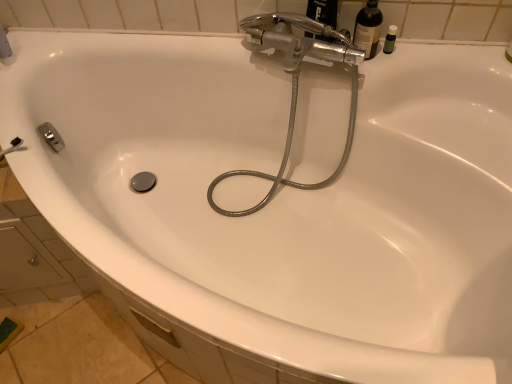
Question: Is the position of green plastic bottle at upper right less distant than that of metallic hose at center?

Choices:
 (A) yes
 (B) no

Answer: (B)

Question: Does green plastic bottle at upper right have a greater width compared to metallic hose at center?

Choices:
 (A) yes
 (B) no

Answer: (B)

Question: Is green plastic bottle at upper right at the right side of metallic hose at center?

Choices:
 (A) no
 (B) yes

Answer: (B)

Question: Is green plastic bottle at upper right positioned behind metallic hose at center?

Choices:
 (A) no
 (B) yes

Answer: (B)

Question: Can you confirm if green plastic bottle at upper right is taller than metallic hose at center?

Choices:
 (A) no
 (B) yes

Answer: (A)

Question: Based on their sizes in the image, would you say green plastic bottle at upper right is bigger or smaller than metallic hose at center?

Choices:
 (A) big
 (B) small

Answer: (B)

Question: From a real-world perspective, relative to metallic hose at center, is green plastic bottle at upper right vertically above or below?

Choices:
 (A) below
 (B) above

Answer: (B)

Question: From their relative heights in the image, would you say green plastic bottle at upper right is taller or shorter than metallic hose at center?

Choices:
 (A) short
 (B) tall

Answer: (A)

Question: Is green plastic bottle at upper right inside or outside of metallic hose at center?

Choices:
 (A) inside
 (B) outside

Answer: (B)

Question: Choose the correct answer: Is metallic hose at center inside green plastic bottle at upper right or outside it?

Choices:
 (A) outside
 (B) inside

Answer: (A)

Question: Does point (352, 77) appear closer or farther from the camera than point (394, 36)?

Choices:
 (A) farther
 (B) closer

Answer: (B)

Question: From their relative heights in the image, would you say metallic hose at center is taller or shorter than green plastic bottle at upper right?

Choices:
 (A) tall
 (B) short

Answer: (A)

Question: Considering their positions, is metallic hose at center located in front of or behind green plastic bottle at upper right?

Choices:
 (A) behind
 (B) front

Answer: (B)

Question: Looking at the image, does metallic hose at center seem bigger or smaller compared to translucent glass bottle at upper right?

Choices:
 (A) small
 (B) big

Answer: (B)

Question: Is metallic hose at center to the left or to the right of translucent glass bottle at upper right in the image?

Choices:
 (A) right
 (B) left

Answer: (B)